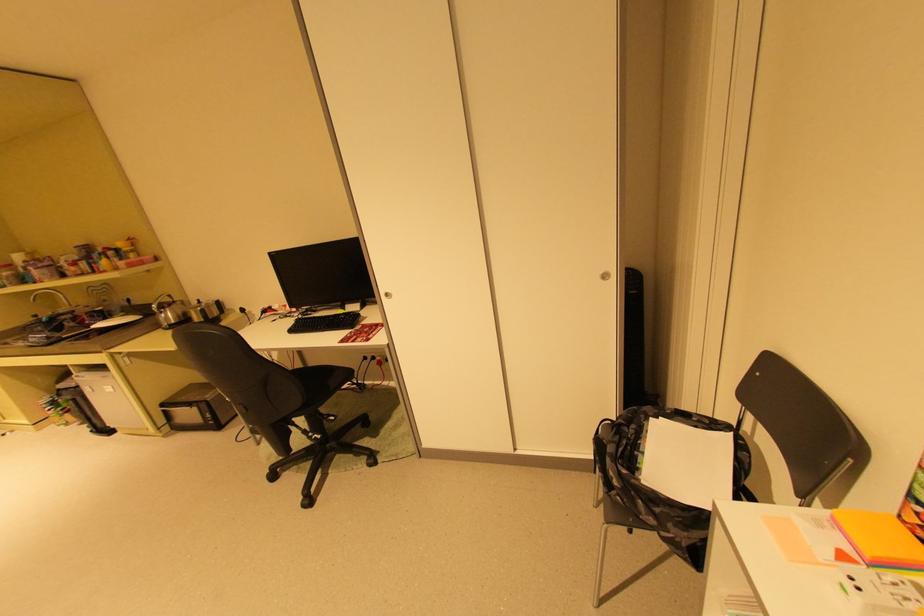
At what (x,y) coordinates should I click in order to perform the action: click on recessed door handle. Please return your answer as a coordinate pair (x, y). Looking at the image, I should click on (612, 276).